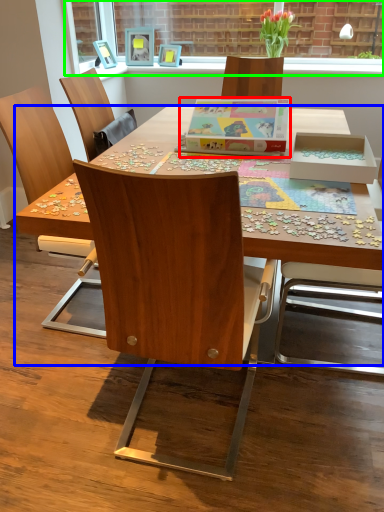
Question: Which object is positioned farthest from cardboard box (highlighted by a red box)? Select from desk (highlighted by a blue box) and window screen (highlighted by a green box).

Choices:
 (A) desk
 (B) window screen

Answer: (B)